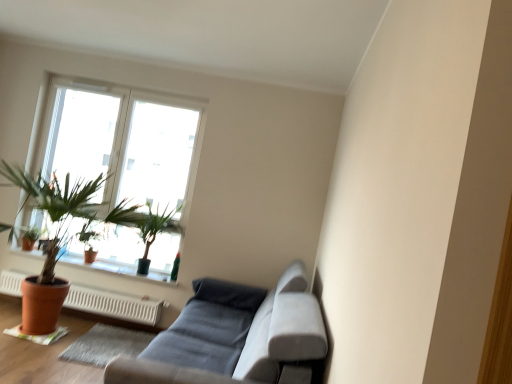
Question: Do you think white plastic heater at lower left is within transparent glass window at upper left, or outside of it?

Choices:
 (A) inside
 (B) outside

Answer: (B)

Question: In the image, is white plastic heater at lower left positioned in front of or behind transparent glass window at upper left?

Choices:
 (A) behind
 (B) front

Answer: (B)

Question: Which object is the closest to the white plastic heater at lower left?

Choices:
 (A) gray fabric couch at lower center
 (B) transparent glass window at upper left
 (C) terracotta pot at lower left
 (D) green matte plant at upper left, the 2th houseplant when ordered from back to front
 (E) terracotta pot plant at left, placed as the 3th houseplant when sorted from back to front

Answer: (C)

Question: Estimate the real-world distances between objects in this image. Which object is farther from the green matte plant at upper left, the 2th houseplant when ordered from back to front?

Choices:
 (A) terracotta pot at lower left
 (B) transparent glass window at upper left
 (C) terracotta pot plant at left, positioned as the 1th houseplant in front-to-back order
 (D) terracotta clay pot at lower left
 (E) white plastic heater at lower left

Answer: (B)